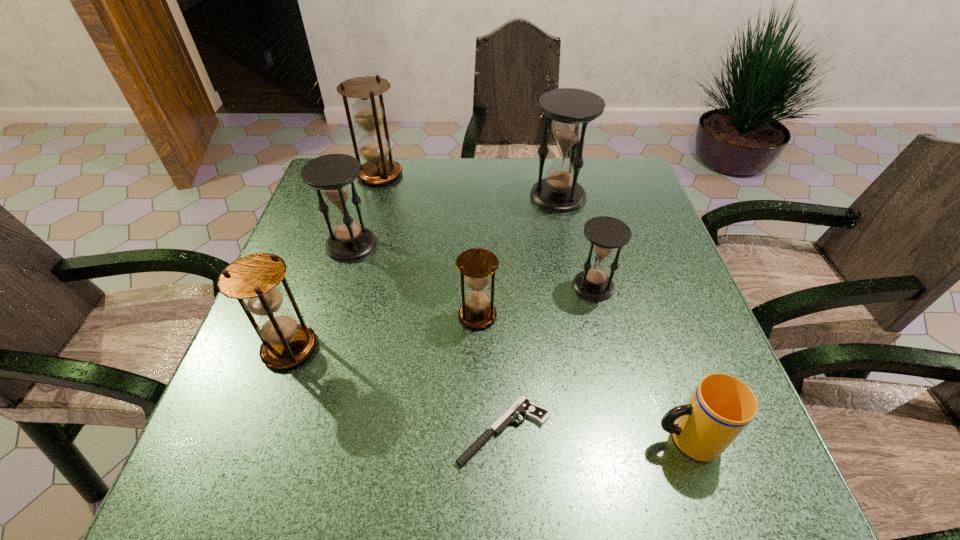
This screenshot has height=540, width=960. Find the location of `the second closest black hourglass to the biggest black hourglass`. the second closest black hourglass to the biggest black hourglass is located at coordinates (332, 175).

Select which brown hourglass appears as the second closest to the leftmost black hourglass. Please provide its 2D coordinates. Your answer should be formatted as a tuple, i.e. [(x, y)], where the tuple contains the x and y coordinates of a point satisfying the conditions above.

[(253, 280)]

Find the location of a particular element. The image size is (960, 540). brown hourglass that is the second closest to the second smallest black hourglass is located at coordinates (253, 280).

Locate an element on the screen. Image resolution: width=960 pixels, height=540 pixels. vacant space that satisfies the following two spatial constraints: 1. on the side of the beige cup with the handle; 2. on the front-facing side of the shortest object is located at coordinates [x=684, y=431].

Locate an element on the screen. This screenshot has width=960, height=540. free point that satisfies the following two spatial constraints: 1. on the side of the beige cup with the handle; 2. on the front side of the nearest black hourglass is located at coordinates [636, 286].